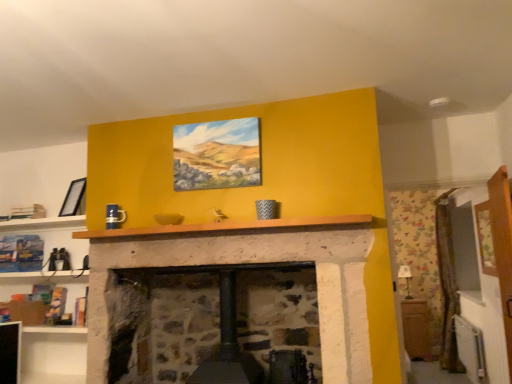
Question: Would you say wooden mantle at center is to the left or to the right of matte black picture frame at upper left, marked as the 1th picture frame in a left-to-right arrangement, in the picture?

Choices:
 (A) right
 (B) left

Answer: (A)

Question: In the image, is wooden mantle at center positioned in front of or behind matte black picture frame at upper left, acting as the second picture frame starting from the right?

Choices:
 (A) front
 (B) behind

Answer: (A)

Question: Which of these objects is positioned closest to the wooden cabinet at right?

Choices:
 (A) matte canvas painting at center, the first picture frame in the front-to-back sequence
 (B) matte black picture frame at upper left, which is the 1th picture frame in back-to-front order
 (C) wooden mantle at center

Answer: (C)

Question: Which of these objects is positioned closest to the matte black picture frame at upper left, which is the 1th picture frame in back-to-front order?

Choices:
 (A) matte canvas painting at center, which is counted as the second picture frame, starting from the back
 (B) wooden mantle at center
 (C) wooden cabinet at right

Answer: (B)